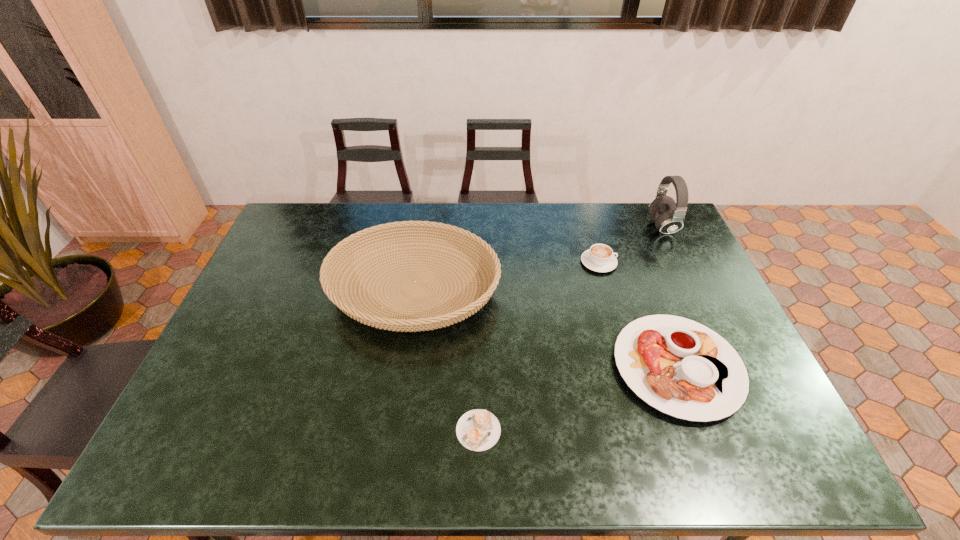
Where is `vacant space at the far edge of the desktop`? vacant space at the far edge of the desktop is located at coordinates (541, 217).

Identify the location of free space at the near edge of the desktop. The image size is (960, 540). (717, 464).

I want to click on blank space at the left edge of the desktop, so tap(256, 294).

You are a GUI agent. You are given a task and a screenshot of the screen. Output one action in this format:
    pyautogui.click(x=<x>, y=<y>)
    Task: Click on the vacant area at the near left corner of the desktop
    This screenshot has width=960, height=540.
    Given the screenshot: What is the action you would take?
    pyautogui.click(x=178, y=439)

Find the location of a particular element. Image resolution: width=960 pixels, height=540 pixels. free location at the near right corner of the desktop is located at coordinates (783, 438).

Where is `free space between the fourth tallest object and the nearer cappuccino`? free space between the fourth tallest object and the nearer cappuccino is located at coordinates (578, 399).

The width and height of the screenshot is (960, 540). I want to click on free spot between the farthest object and the second shortest object, so click(x=670, y=297).

This screenshot has width=960, height=540. Find the location of `vacant area that lies between the tallest object and the fourth tallest object`. vacant area that lies between the tallest object and the fourth tallest object is located at coordinates (670, 297).

Locate an element on the screen. Image resolution: width=960 pixels, height=540 pixels. free point between the farthest object and the fourth shortest object is located at coordinates (539, 258).

I want to click on vacant space in between the shorter cappuccino and the taller cappuccino, so pos(539,346).